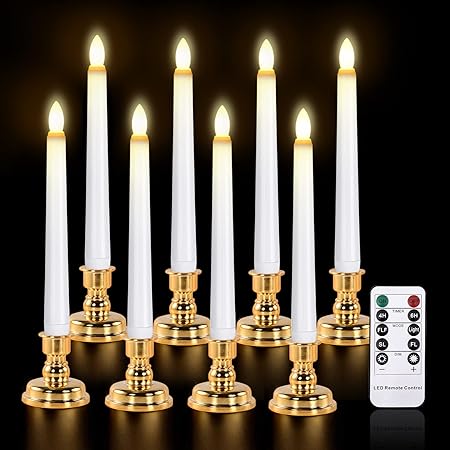
In order to click on candle in this screenshot , I will do `click(227, 242)`, `click(147, 230)`, `click(180, 229)`, `click(97, 209)`, `click(59, 229)`, `click(269, 215)`, `click(299, 225)`, `click(349, 212)`.